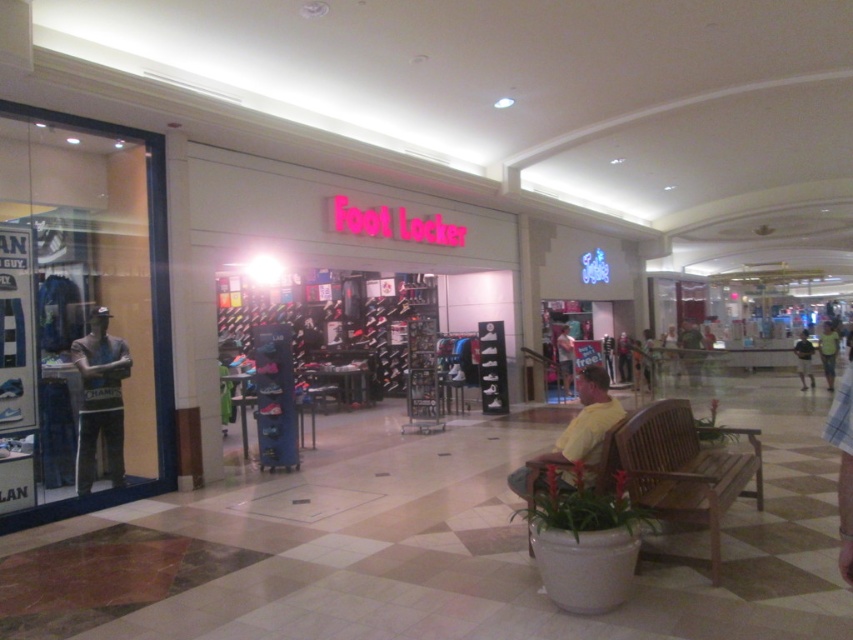
Between gray fabric mannequin at left and yellow cotton shirt at center, which one has more height?

gray fabric mannequin at left is taller.

Does gray fabric mannequin at left appear on the left side of yellow cotton shirt at center?

Indeed, gray fabric mannequin at left is positioned on the left side of yellow cotton shirt at center.

Between point (84, 392) and point (566, 346), which one is positioned behind?

Positioned behind is point (566, 346).

Locate an element on the screen. gray fabric mannequin at left is located at coordinates (99, 400).

Is yellow cotton shirt at center further to camera compared to light brown shorts at center?

No, yellow cotton shirt at center is in front of light brown shorts at center.

The width and height of the screenshot is (853, 640). Describe the element at coordinates (566, 358) in the screenshot. I see `yellow cotton shirt at center` at that location.

Identify the location of yellow cotton shirt at center. The width and height of the screenshot is (853, 640). (566, 358).

Is yellow cotton shirt at lower right bigger than light brown shorts at center?

No, yellow cotton shirt at lower right is not bigger than light brown shorts at center.

Between yellow cotton shirt at lower right and light brown shorts at center, which one has more height?

light brown shorts at center

This screenshot has height=640, width=853. What do you see at coordinates (575, 435) in the screenshot?
I see `yellow cotton shirt at lower right` at bounding box center [575, 435].

The width and height of the screenshot is (853, 640). I want to click on yellow cotton shirt at lower right, so click(575, 435).